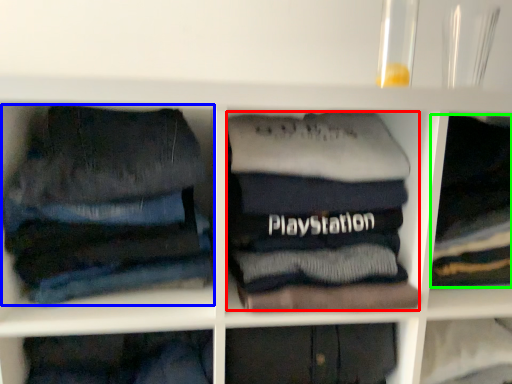
Question: Considering the real-world distances, which object is farthest from clothing (highlighted by a red box)? trousers (highlighted by a blue box) or clothing (highlighted by a green box)?

Choices:
 (A) trousers
 (B) clothing

Answer: (B)